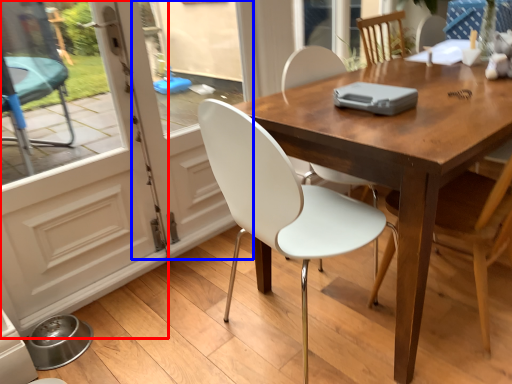
Question: Which of the following is the closest to the observer, screen door (highlighted by a red box) or screen door (highlighted by a blue box)?

Choices:
 (A) screen door
 (B) screen door

Answer: (A)